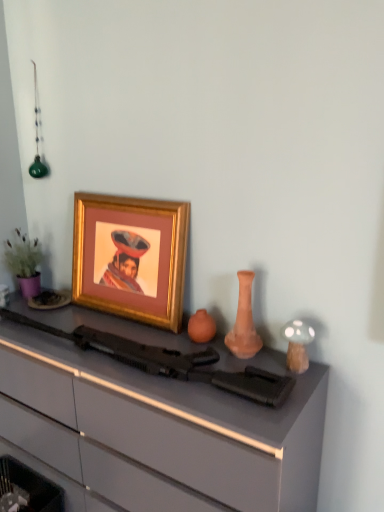
Question: Is gold-framed picture at upper left inside or outside of terracotta vase at center?

Choices:
 (A) inside
 (B) outside

Answer: (B)

Question: Considering the positions of gold-framed picture at upper left and terracotta vase at center in the image, is gold-framed picture at upper left taller or shorter than terracotta vase at center?

Choices:
 (A) tall
 (B) short

Answer: (A)

Question: Which object is positioned farthest from the terracotta vase at center?

Choices:
 (A) matte black rifle at center
 (B) white glossy mushroom at right
 (C) gold-framed picture at upper left
 (D) matte gray desk at center

Answer: (D)

Question: Estimate the real-world distances between objects in this image. Which object is farther from the matte black rifle at center?

Choices:
 (A) matte gray desk at center
 (B) gold-framed picture at upper left
 (C) white glossy mushroom at right
 (D) terracotta vase at center

Answer: (B)